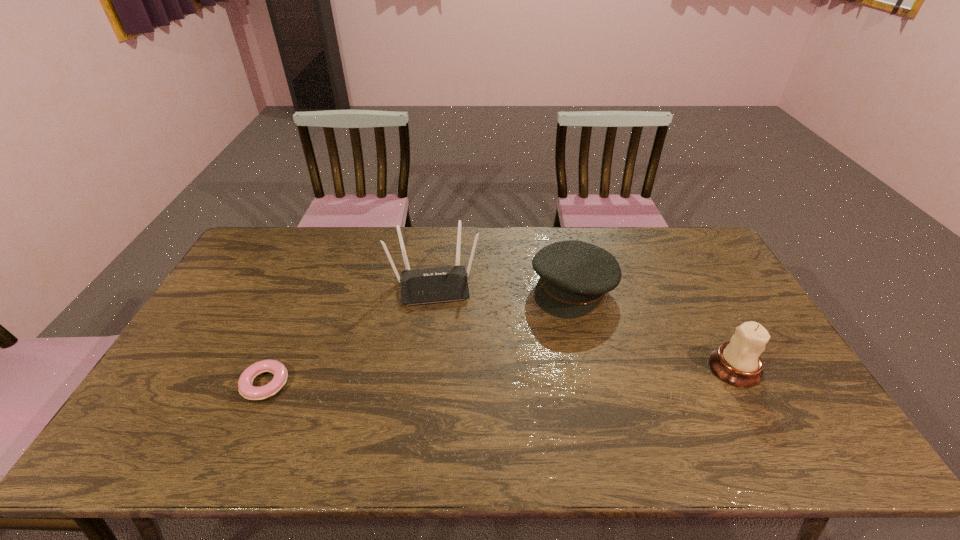
Image resolution: width=960 pixels, height=540 pixels. What are the coordinates of `free space between the second object from left to right and the candle holder` in the screenshot? It's located at (585, 326).

At what (x,y) coordinates should I click in order to perform the action: click on unoccupied area between the third object from right to left and the third tallest object. Please return your answer as a coordinate pair (x, y). This screenshot has width=960, height=540. Looking at the image, I should click on (503, 286).

The width and height of the screenshot is (960, 540). I want to click on free point between the candle holder and the beret, so click(x=654, y=328).

Find the location of a particular element. object that is the second closest to the candle holder is located at coordinates (430, 285).

The height and width of the screenshot is (540, 960). What are the coordinates of `object that is the third closest to the second object from left to right` in the screenshot? It's located at (738, 362).

Where is `free space that satisfies the following two spatial constraints: 1. on the front side of the third object from right to left; 2. on the left side of the rightmost object`? The width and height of the screenshot is (960, 540). free space that satisfies the following two spatial constraints: 1. on the front side of the third object from right to left; 2. on the left side of the rightmost object is located at coordinates (424, 368).

Image resolution: width=960 pixels, height=540 pixels. Find the location of `blank space that satisfies the following two spatial constraints: 1. on the back side of the second object from right to left; 2. on the left side of the leftmost object`. blank space that satisfies the following two spatial constraints: 1. on the back side of the second object from right to left; 2. on the left side of the leftmost object is located at coordinates (307, 288).

The image size is (960, 540). I want to click on vacant space that satisfies the following two spatial constraints: 1. on the front side of the rightmost object; 2. on the right side of the second object from left to right, so click(x=424, y=368).

You are a GUI agent. You are given a task and a screenshot of the screen. Output one action in this format:
    pyautogui.click(x=<x>, y=<y>)
    Task: Click on the vacant region that satisfies the following two spatial constraints: 1. on the front side of the candle holder; 2. on the right side of the second object from right to left
    
    Given the screenshot: What is the action you would take?
    pyautogui.click(x=591, y=368)